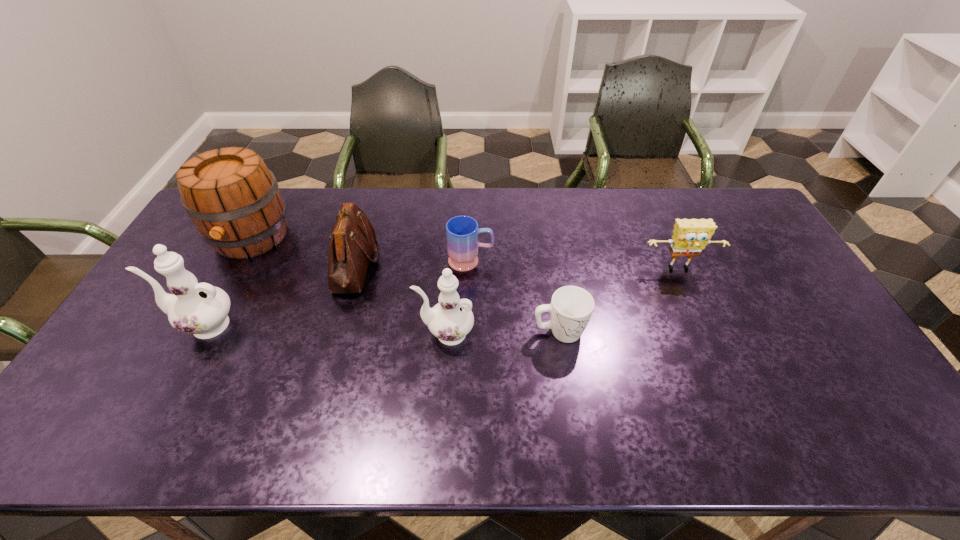
This screenshot has width=960, height=540. I want to click on free space located 0.120m at the spout of the taller chinaware, so click(x=128, y=326).

You are a GUI agent. You are given a task and a screenshot of the screen. Output one action in this format:
    pyautogui.click(x=<x>, y=<y>)
    Task: Click on the vacant space located at the spout of the taller chinaware
    The height and width of the screenshot is (540, 960).
    Given the screenshot: What is the action you would take?
    pyautogui.click(x=138, y=326)

Locate an element on the screen. This screenshot has width=960, height=540. vacant space situated 0.340m at the spout of the shorter chinaware is located at coordinates (294, 334).

Locate an element on the screen. The image size is (960, 540). free spot located at the spout of the shorter chinaware is located at coordinates (373, 334).

The image size is (960, 540). Identify the location of free location located 0.210m at the spout of the shorter chinaware. (341, 334).

This screenshot has height=540, width=960. Identify the location of vacant space located on the side of the cider where the spigot is located. (177, 372).

The height and width of the screenshot is (540, 960). In order to click on free space located on the side of the farther mug with the handle in this screenshot , I will do `click(528, 261)`.

Where is `vacant space located on the front of the third object from left to right`? vacant space located on the front of the third object from left to right is located at coordinates pyautogui.click(x=327, y=362).

Identify the location of free space located on the side of the nearer mug with the handle. (633, 332).

Locate an element on the screen. This screenshot has height=540, width=960. vacant region located 0.090m on the face of the fifth tallest object is located at coordinates (693, 300).